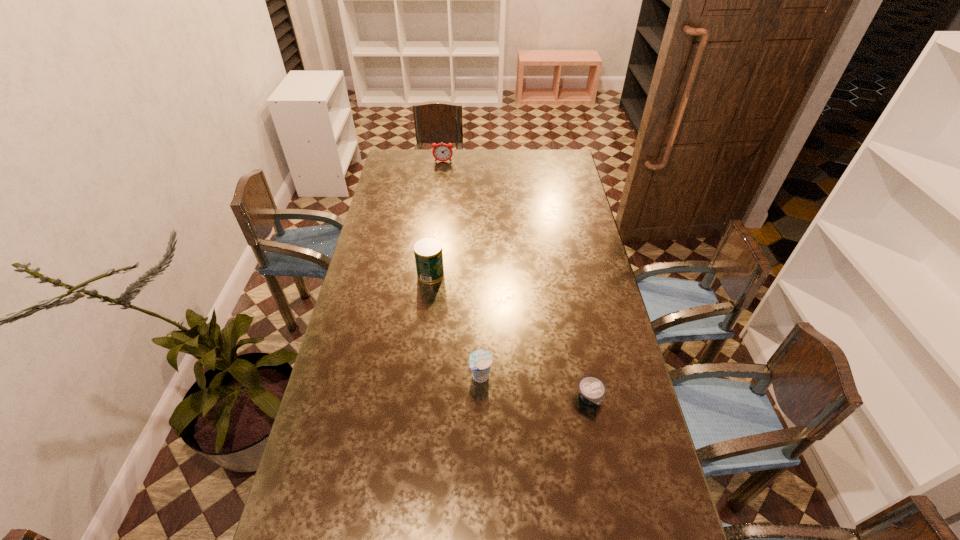
This screenshot has height=540, width=960. In order to click on blank area in the image that satisfies the following two spatial constraints: 1. on the front-facing side of the second tallest object; 2. on the left side of the taller yogurt in this screenshot , I will do `click(419, 376)`.

Image resolution: width=960 pixels, height=540 pixels. What are the coordinates of `vacant region that satisfies the following two spatial constraints: 1. on the front-facing side of the can; 2. on the right side of the second tallest object` in the screenshot? It's located at (430, 274).

What are the coordinates of `vacant space that satisfies the following two spatial constraints: 1. on the front-facing side of the tallest object; 2. on the right side of the farthest object` in the screenshot? It's located at (430, 274).

Identify the location of free space that satisfies the following two spatial constraints: 1. on the front-facing side of the third tallest object; 2. on the left side of the alarm clock. The image size is (960, 540). (419, 376).